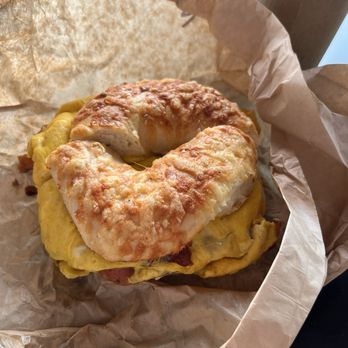
This screenshot has height=348, width=348. Identify the location of crumb. (17, 183), (17, 162).